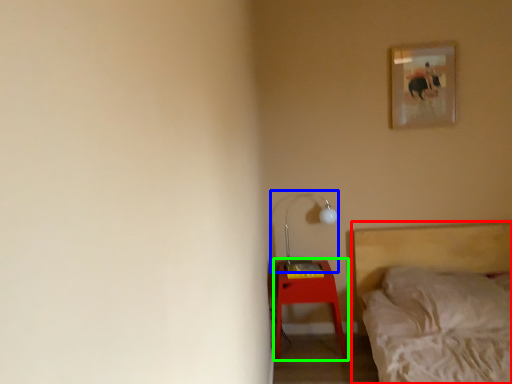
Question: Which object is the farthest from bed (highlighted by a red box)? Choose among these: table lamp (highlighted by a blue box) or nightstand (highlighted by a green box).

Choices:
 (A) table lamp
 (B) nightstand

Answer: (A)